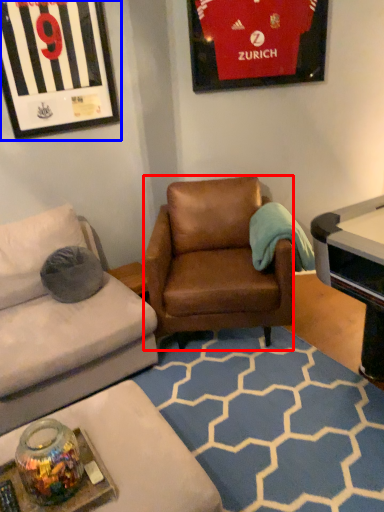
Question: Which point is closer to the camera, chair (highlighted by a red box) or picture frame (highlighted by a blue box)?

Choices:
 (A) chair
 (B) picture frame

Answer: (A)